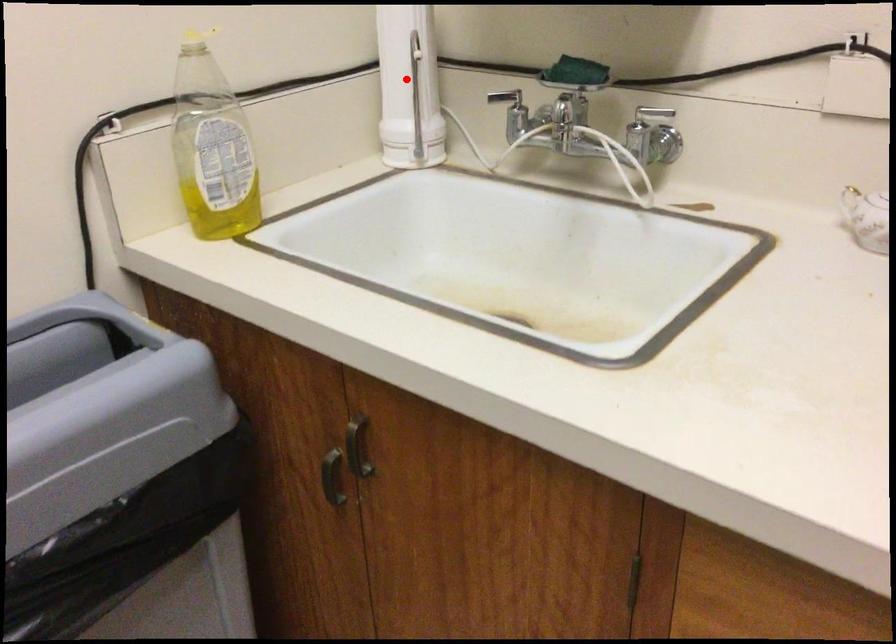
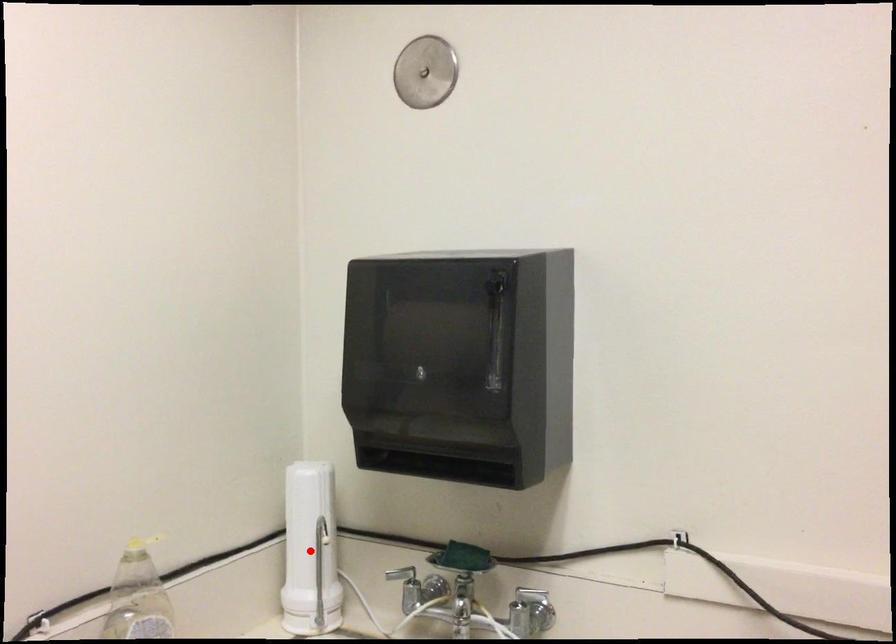
I am providing you with two images of the same scene from different viewpoints. A red point is marked on the first image and another point is marked on the second image. Does the point marked in image1 correspond to the same location as the one in image2?

Yes